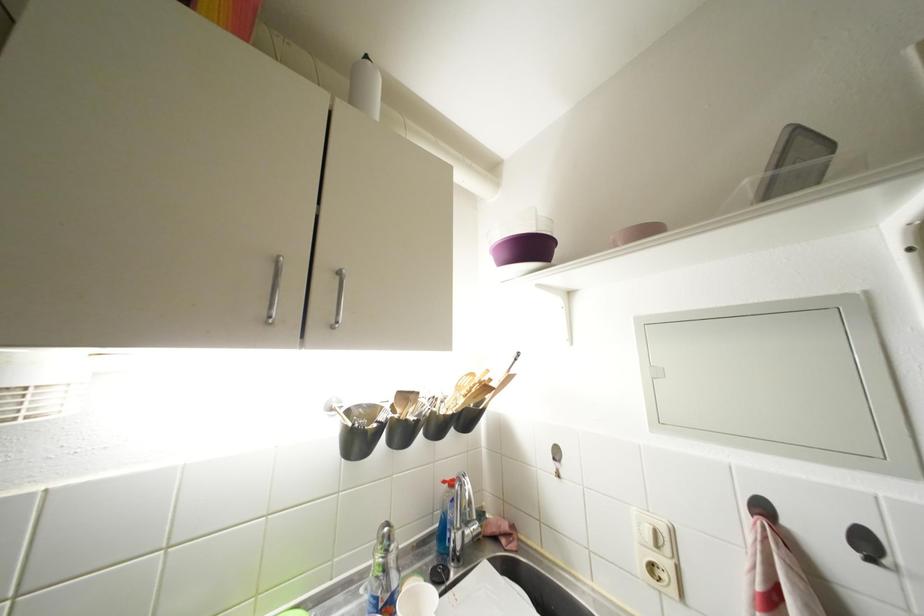
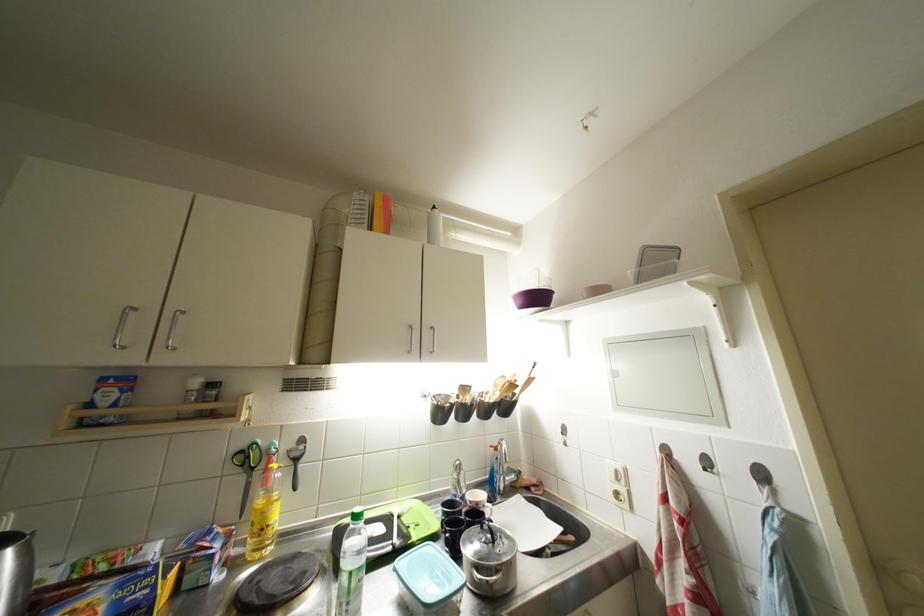
In the second image, find the point that corresponds to point 512,259 in the first image.

(527, 306)